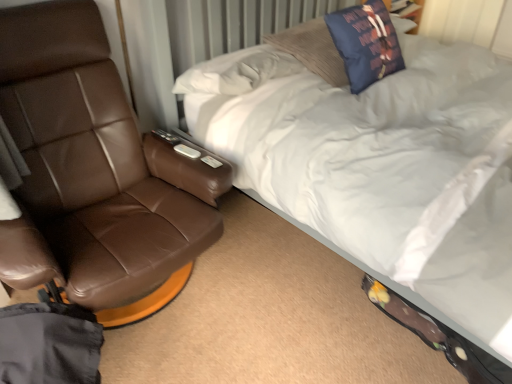
Question: In the image, is brown leather chair at left positioned in front of or behind navy blue fabric pillow at upper center?

Choices:
 (A) front
 (B) behind

Answer: (A)

Question: From the image's perspective, is brown leather chair at left positioned above or below navy blue fabric pillow at upper center?

Choices:
 (A) below
 (B) above

Answer: (A)

Question: Which is farther from the navy blue fabric pillow at upper center?

Choices:
 (A) white soft bed at upper right
 (B) brown leather chair at left

Answer: (B)

Question: Based on their relative distances, which object is farther from the brown leather chair at left?

Choices:
 (A) white soft bed at upper right
 (B) navy blue fabric pillow at upper center

Answer: (B)